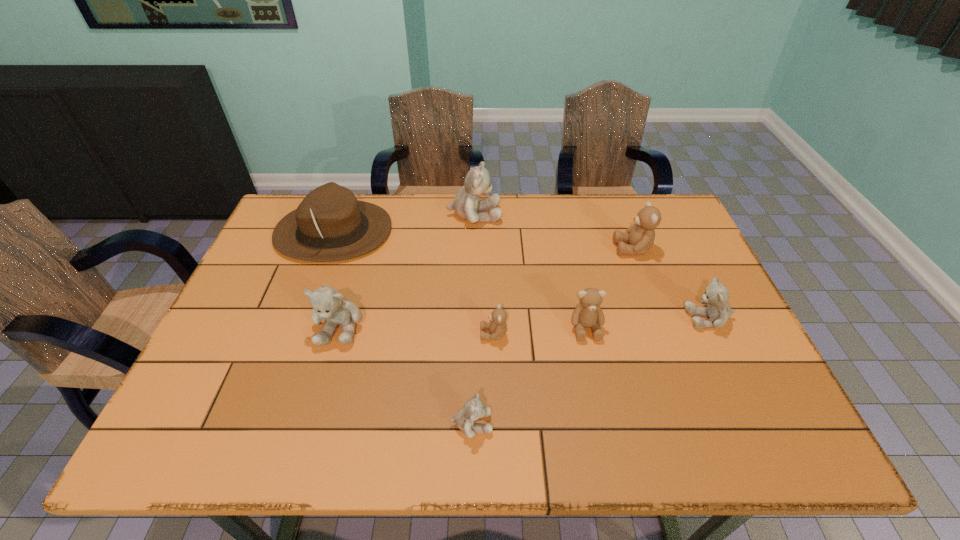
This screenshot has height=540, width=960. What are the coordinates of `the rightmost teddy bear` in the screenshot? It's located at (719, 311).

The height and width of the screenshot is (540, 960). I want to click on the leftmost brown teddy bear, so click(x=497, y=327).

Image resolution: width=960 pixels, height=540 pixels. Find the location of `the nearest teddy bear`. the nearest teddy bear is located at coordinates (473, 409).

Locate an element on the screen. This screenshot has height=540, width=960. the nearest object is located at coordinates (473, 409).

In order to click on vacant space positioned on the face of the farthest teddy bear in this screenshot , I will do `click(559, 215)`.

I want to click on vacant position located 0.110m on the feather side of the fedora, so click(426, 232).

Locate an element on the screen. This screenshot has height=540, width=960. free space located 0.180m on the front-facing side of the rightmost brown teddy bear is located at coordinates (555, 248).

Image resolution: width=960 pixels, height=540 pixels. In order to click on free space located on the front-facing side of the rightmost brown teddy bear in this screenshot , I will do `click(505, 248)`.

Image resolution: width=960 pixels, height=540 pixels. Identify the location of vacant space situated on the front-facing side of the rightmost brown teddy bear. (564, 248).

Image resolution: width=960 pixels, height=540 pixels. I want to click on free spot located on the face of the leftmost gray teddy bear, so [x=321, y=390].